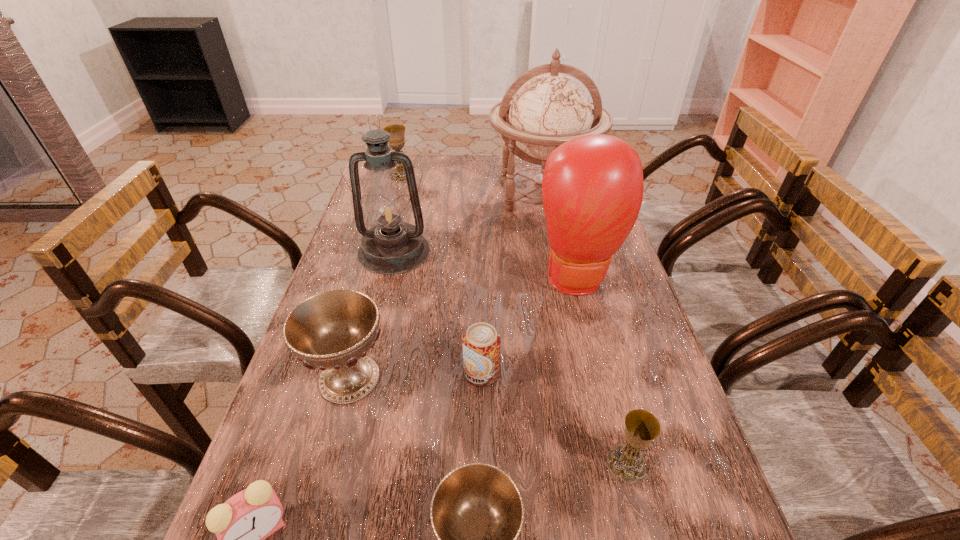
What are the coordinates of `globe present at the right edge` in the screenshot? It's located at (550, 109).

Identify the location of boxing glove situated at the right edge. tap(592, 188).

Where is `chalice located in the right edge section of the desktop`? The image size is (960, 540). chalice located in the right edge section of the desktop is located at coordinates (641, 427).

The width and height of the screenshot is (960, 540). What are the coordinates of `object that is at the far left corner` in the screenshot? It's located at (397, 132).

At what (x,y) coordinates should I click in order to perform the action: click on object that is positioned at the far right corner. Please return your answer as a coordinate pair (x, y). Looking at the image, I should click on (550, 109).

The height and width of the screenshot is (540, 960). I want to click on vacant space at the far edge, so click(434, 174).

Locate an element on the screen. Image resolution: width=960 pixels, height=540 pixels. free space at the left edge of the desktop is located at coordinates (333, 507).

Image resolution: width=960 pixels, height=540 pixels. Find the location of `free spot at the right edge of the desktop`. free spot at the right edge of the desktop is located at coordinates (611, 316).

The height and width of the screenshot is (540, 960). I want to click on free area in between the beer can and the farther red chalice, so click(x=416, y=375).

Identify the location of unoccupied area between the nearer gold chalice and the oil lamp. (511, 357).